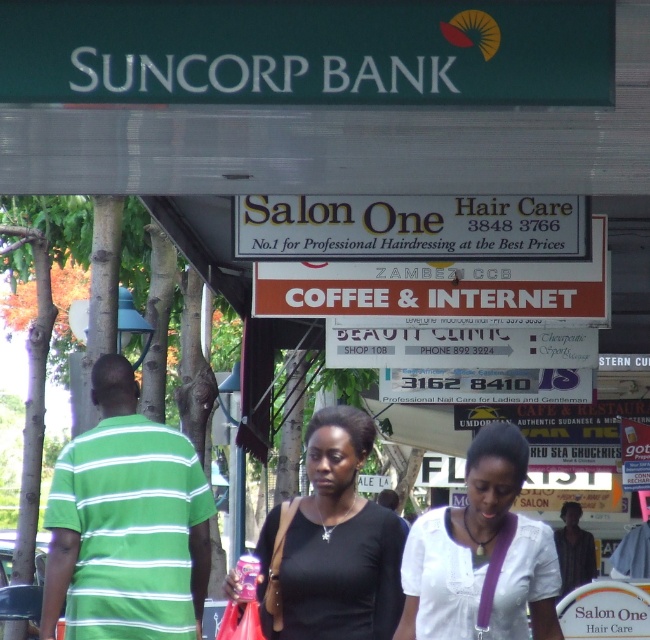
Who is shorter, black matte shirt at center or white matte shirt at center?

With less height is white matte shirt at center.

Is black matte shirt at center above white matte shirt at center?

Indeed, black matte shirt at center is positioned over white matte shirt at center.

Is point (229, 579) farther from camera compared to point (396, 632)?

Yes, point (229, 579) is behind point (396, 632).

Locate an element on the screen. This screenshot has width=650, height=640. black matte shirt at center is located at coordinates (332, 544).

Is green striped shirt at center to the left of dark brown leather jacket at center from the viewer's perspective?

Yes, green striped shirt at center is to the left of dark brown leather jacket at center.

Measure the distance between green striped shirt at center and camera.

9.29 meters

At what (x,y) coordinates should I click in order to perform the action: click on green striped shirt at center. Please return your answer as a coordinate pair (x, y). This screenshot has height=640, width=650. Looking at the image, I should click on tap(125, 524).

Can you confirm if white matte shirt at center is smaller than dark brown leather jacket at center?

Actually, white matte shirt at center might be larger than dark brown leather jacket at center.

Who is shorter, white matte shirt at center or dark brown leather jacket at center?

With less height is dark brown leather jacket at center.

Is point (443, 570) positioned after point (572, 577)?

No.

I want to click on white matte shirt at center, so click(462, 540).